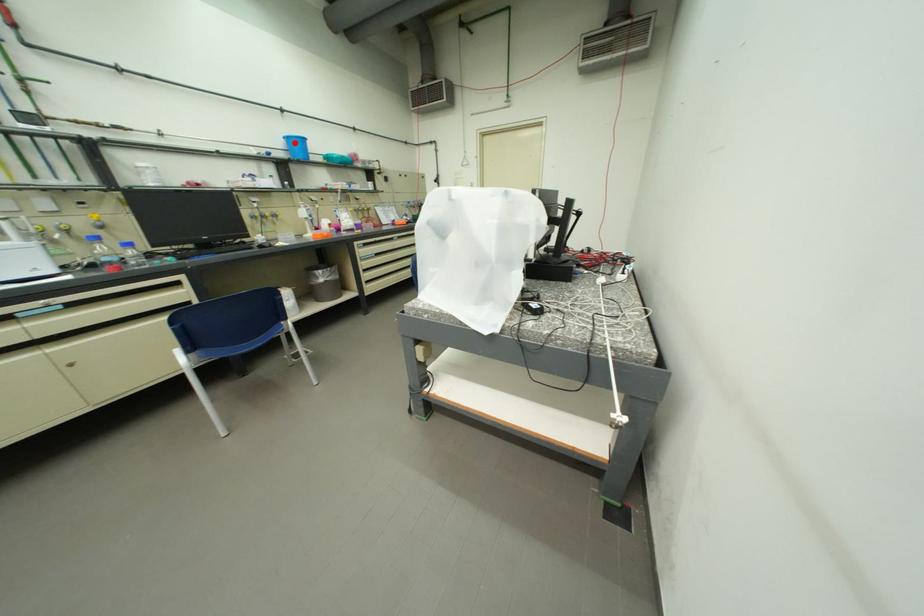
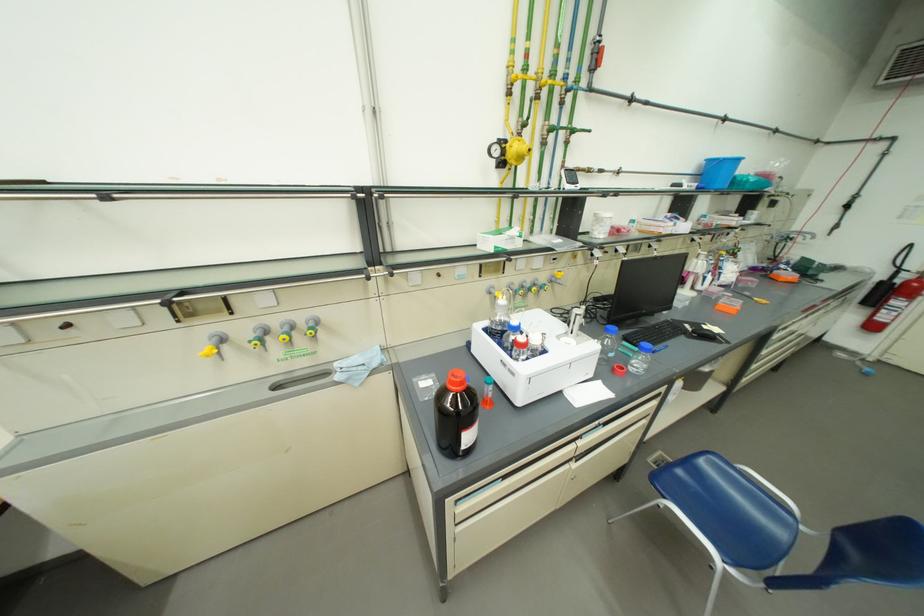
Question: I am providing you with two images of the same scene from different viewpoints. A red point is marked on the first image. Can you still see the location of the red point in image 2?

Choices:
 (A) Yes
 (B) No

Answer: (A)